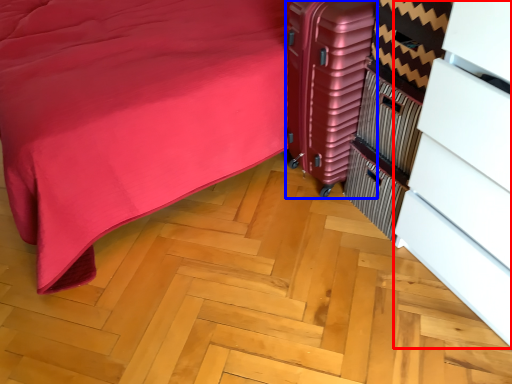
Question: Which point is closer to the camera, dresser (highlighted by a red box) or luggage (highlighted by a blue box)?

Choices:
 (A) dresser
 (B) luggage

Answer: (A)